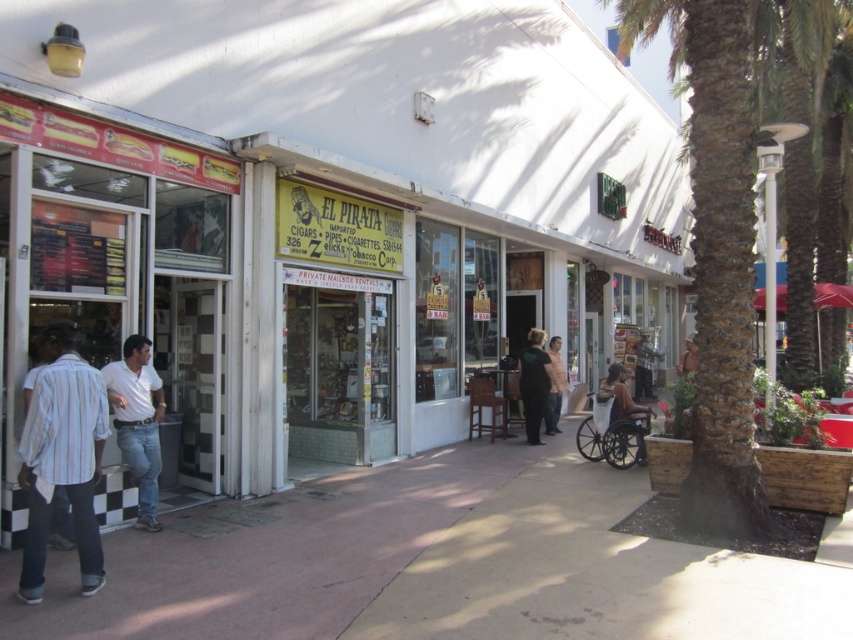
Question: Is green leafy palm tree at center thinner than light pink shirt at center?

Choices:
 (A) no
 (B) yes

Answer: (A)

Question: Which of these objects is positioned closest to the black plastic wheelchair at center?

Choices:
 (A) light blue striped shirt at left
 (B) black fabric shirt at center

Answer: (B)

Question: Is green leafy palm tree at center positioned at the back of light pink shirt at center?

Choices:
 (A) yes
 (B) no

Answer: (B)

Question: Does green leafy palm tree at center have a greater width compared to light pink shirt at center?

Choices:
 (A) no
 (B) yes

Answer: (B)

Question: Which point is closer to the camera?

Choices:
 (A) (727, 372)
 (B) (546, 428)
 (C) (815, 632)
 (D) (148, 444)

Answer: (C)

Question: Which object is positioned farthest from the black fabric shirt at center?

Choices:
 (A) light pink shirt at center
 (B) white cotton shirt at center

Answer: (B)